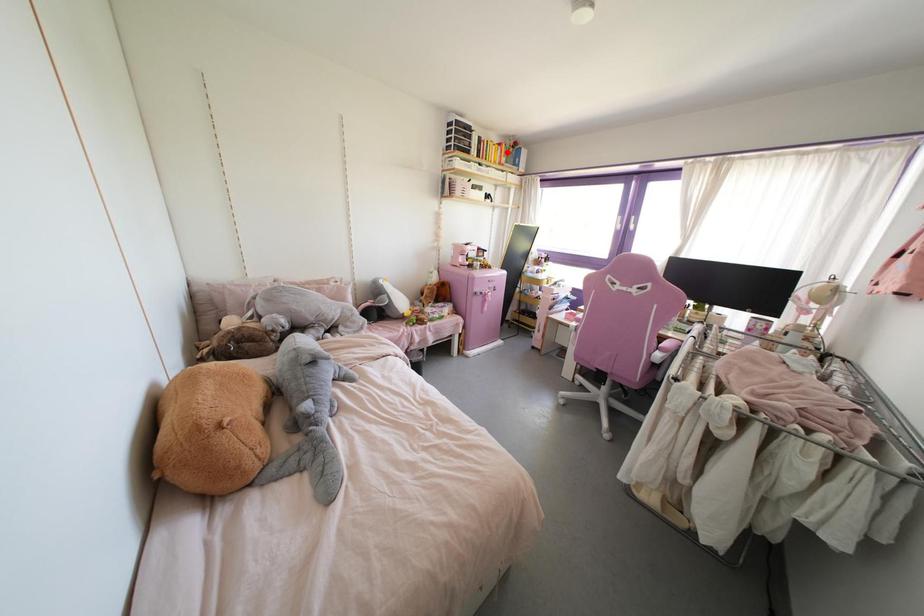
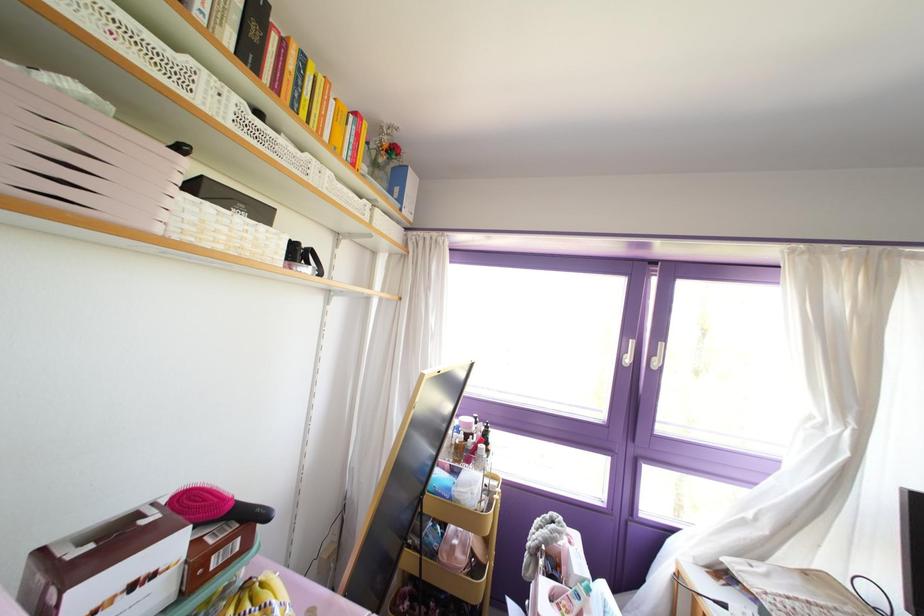
The point at the highlighted location is marked in the first image. Where is the corresponding point in the second image?

(372, 163)